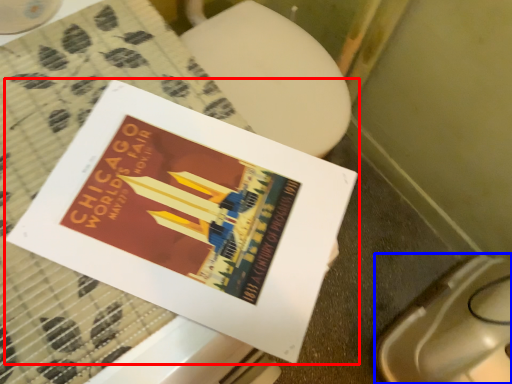
Question: Among these objects, which one is nearest to the camera, book (highlighted by a red box) or toilet bowl (highlighted by a blue box)?

Choices:
 (A) book
 (B) toilet bowl

Answer: (A)